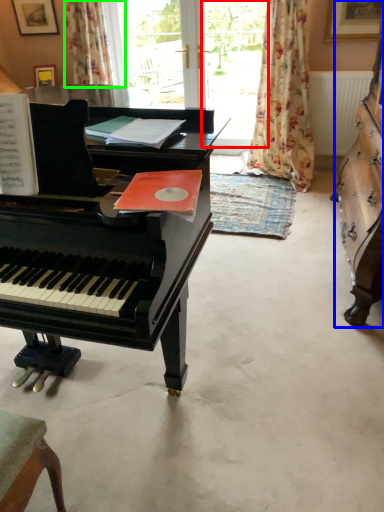
Question: Which object is positioned farthest from window screen (highlighted by a red box)? Select from harpsichord (highlighted by a blue box) and curtain (highlighted by a green box).

Choices:
 (A) harpsichord
 (B) curtain

Answer: (A)